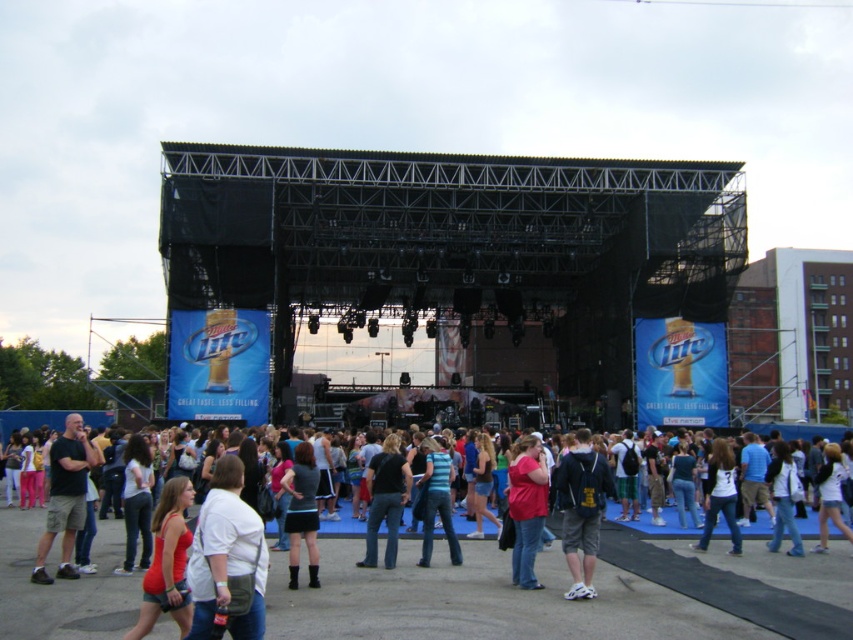
Does matte pink shirt at center come behind striped cotton shirt at center?

No.

Based on the photo, is matte pink shirt at center smaller than striped cotton shirt at center?

Actually, matte pink shirt at center might be larger than striped cotton shirt at center.

Is point (519, 516) positioned after point (436, 456)?

No, (519, 516) is closer to viewer.

Where is `matte pink shirt at center`? matte pink shirt at center is located at coordinates (526, 508).

Is point (62, 531) less distant than point (782, 492)?

Yes, it is.

Which is more to the left, dark gray shorts at center or denim jacket at lower right?

Positioned to the left is dark gray shorts at center.

Who is more distant from viewer, (71, 532) or (786, 502)?

Positioned behind is point (786, 502).

This screenshot has height=640, width=853. I want to click on dark gray shorts at center, so click(65, 497).

Does point (364, 532) come in front of point (457, 552)?

No, it is behind (457, 552).

Which is more to the right, jeans at center or striped cotton shirt at center?

striped cotton shirt at center is more to the right.

This screenshot has height=640, width=853. Identify the location of jeans at center. [386, 499].